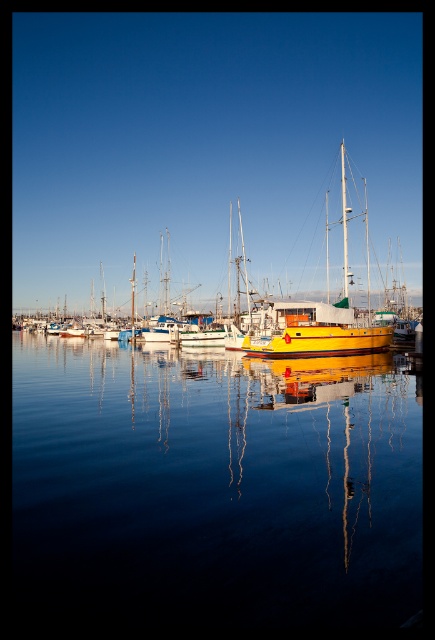
Question: Is glossy water at center in front of yellow matte sailboat at center?

Choices:
 (A) yes
 (B) no

Answer: (A)

Question: Does glossy water at center have a greater width compared to yellow matte sailboat at center?

Choices:
 (A) no
 (B) yes

Answer: (A)

Question: Which object is closer to the camera taking this photo?

Choices:
 (A) yellow matte sailboat at center
 (B) glossy water at center

Answer: (B)

Question: Is glossy water at center positioned before yellow matte sailboat at center?

Choices:
 (A) yes
 (B) no

Answer: (A)

Question: Which point appears closest to the camera in this image?

Choices:
 (A) (291, 321)
 (B) (348, 596)

Answer: (B)